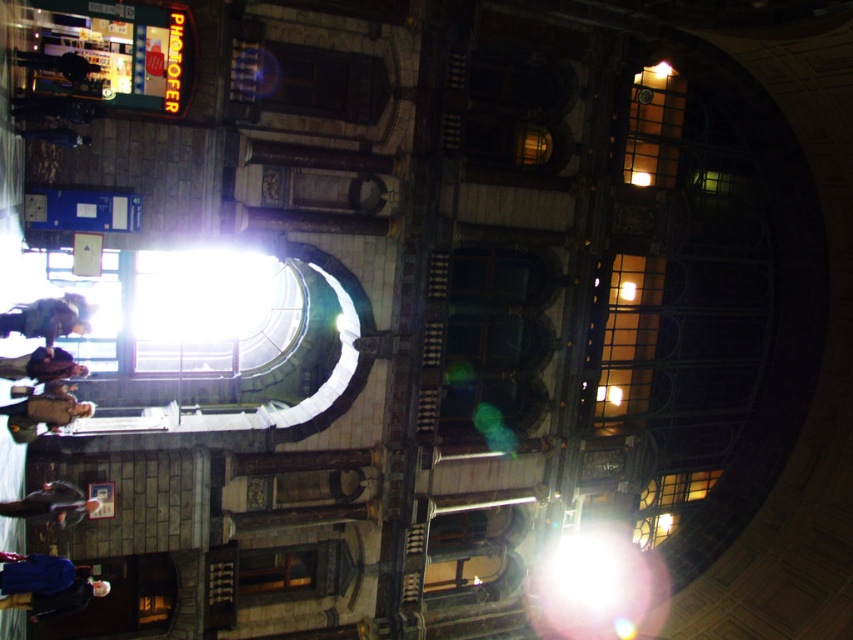
Does dark blue coat at lower left appear under matte black jacket at lower left?

Yes, dark blue coat at lower left is below matte black jacket at lower left.

Which is more to the left, dark blue coat at lower left or matte black jacket at lower left?

Positioned to the left is dark blue coat at lower left.

Where is `dark blue coat at lower left`? The width and height of the screenshot is (853, 640). dark blue coat at lower left is located at coordinates (45, 584).

Which is more to the right, matte black jacket at lower left or brown leather jacket at lower left?

From the viewer's perspective, matte black jacket at lower left appears more on the right side.

Identify the location of matte black jacket at lower left. This screenshot has height=640, width=853. (51, 504).

Identify the location of dark brown leather jacket at lower left. The height and width of the screenshot is (640, 853). (48, 317).

Which is above, dark brown leather jacket at lower left or matte brown coat at lower left?

dark brown leather jacket at lower left is above.

Describe the element at coordinates (48, 317) in the screenshot. I see `dark brown leather jacket at lower left` at that location.

You are a GUI agent. You are given a task and a screenshot of the screen. Output one action in this format:
    pyautogui.click(x=<x>, y=<y>)
    Task: Click on the dark brown leather jacket at lower left
    This screenshot has height=640, width=853.
    Given the screenshot: What is the action you would take?
    pyautogui.click(x=48, y=317)